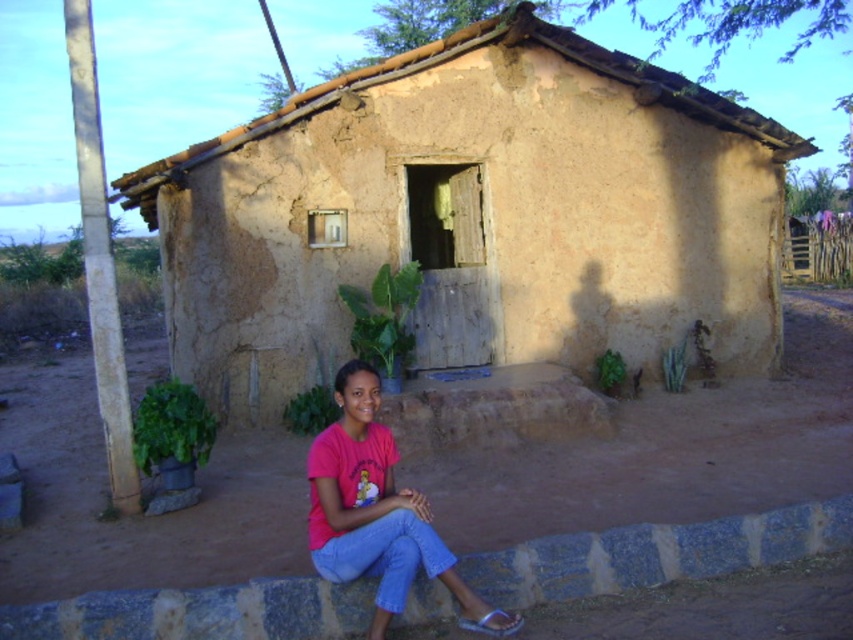
Question: Can you confirm if brown dirt field at center is bigger than pink matte shirt at center?

Choices:
 (A) yes
 (B) no

Answer: (A)

Question: Among these objects, which one is nearest to the camera?

Choices:
 (A) brown mud hut at center
 (B) brown dirt field at center

Answer: (B)

Question: Which is farther from the brown mud hut at center?

Choices:
 (A) brown dirt field at center
 (B) pink matte shirt at center

Answer: (B)

Question: Is brown dirt field at center to the left of pink matte shirt at center from the viewer's perspective?

Choices:
 (A) no
 (B) yes

Answer: (A)

Question: Does brown dirt field at center come behind pink matte shirt at center?

Choices:
 (A) yes
 (B) no

Answer: (A)

Question: Estimate the real-world distances between objects in this image. Which object is closer to the pink matte shirt at center?

Choices:
 (A) brown dirt field at center
 (B) brown mud hut at center

Answer: (A)